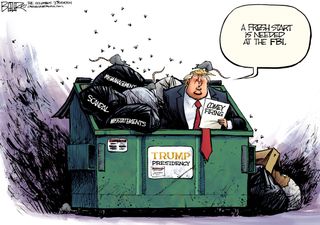
Where is `empty box`? This screenshot has width=320, height=225. empty box is located at coordinates (272, 155).